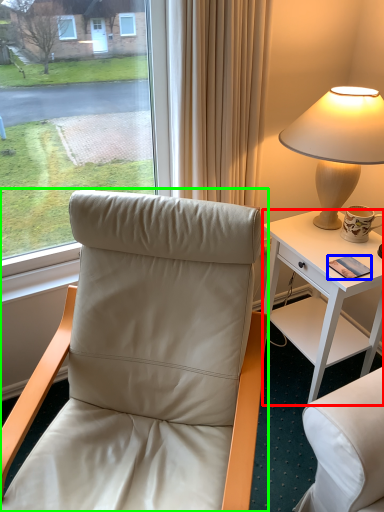
Question: Considering the real-world distances, which object is closest to desk (highlighted by a red box)? mobile phone (highlighted by a blue box) or chair (highlighted by a green box).

Choices:
 (A) mobile phone
 (B) chair

Answer: (A)